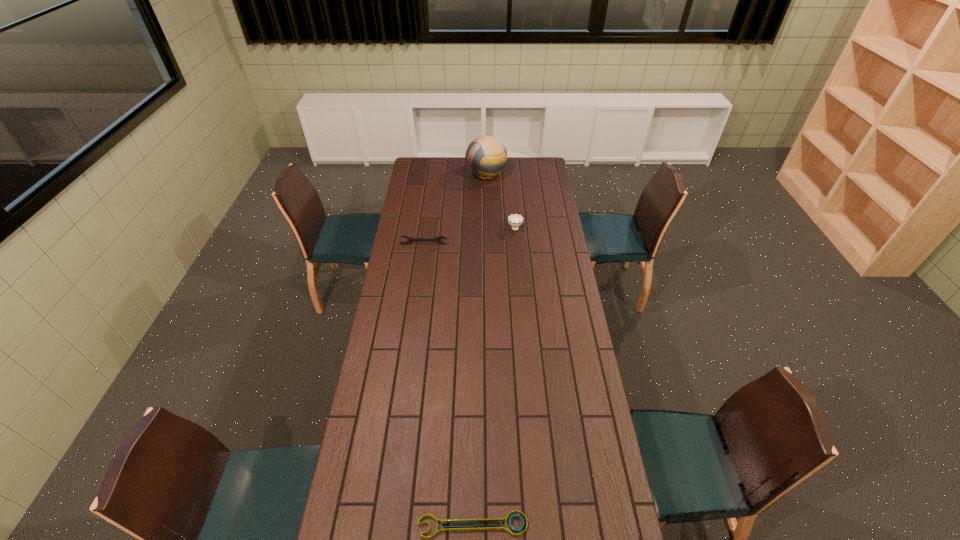
Where is `vacant region located 0.200m on the side of the cup with the handle`? vacant region located 0.200m on the side of the cup with the handle is located at coordinates (x=513, y=199).

I want to click on vacant space located 0.350m on the side of the cup with the handle, so click(511, 184).

Identify the location of vacant point located on the open ends of the taller wrench. This screenshot has width=960, height=540. (423, 252).

Image resolution: width=960 pixels, height=540 pixels. I want to click on vacant area situated on the back of the shorter wrench, so click(x=474, y=410).

This screenshot has width=960, height=540. Find the location of `object present at the far edge`. object present at the far edge is located at coordinates (486, 157).

Find the location of `object at the left edge`. object at the left edge is located at coordinates (438, 239).

In order to click on free location at the far edge of the desktop in this screenshot , I will do `click(516, 177)`.

Locate an element on the screen. vacant region at the left edge of the desktop is located at coordinates (372, 413).

Image resolution: width=960 pixels, height=540 pixels. In order to click on free space at the right edge of the desktop in this screenshot , I will do `click(562, 294)`.

This screenshot has height=540, width=960. In the image, there is a desktop. Find the location of `vacant space at the far left corner`. vacant space at the far left corner is located at coordinates (427, 160).